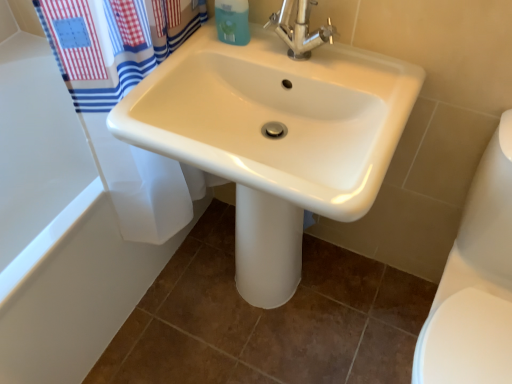
At what (x,y) coordinates should I click in order to perform the action: click on empty space that is ontop of white glossy sink at center (from a real-world perspective). Please return your answer as a coordinate pair (x, y). This screenshot has height=384, width=512. Looking at the image, I should click on [297, 66].